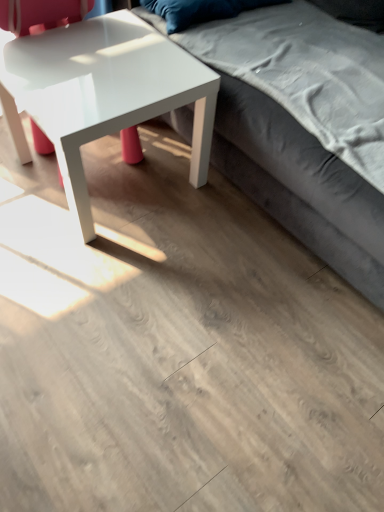
Question: Is velvet blue pillow at upper center next to velvet gray couch at upper right?

Choices:
 (A) yes
 (B) no

Answer: (B)

Question: Is the position of velvet blue pillow at upper center more distant than that of velvet gray couch at upper right?

Choices:
 (A) yes
 (B) no

Answer: (A)

Question: Can you confirm if velvet blue pillow at upper center is smaller than velvet gray couch at upper right?

Choices:
 (A) no
 (B) yes

Answer: (B)

Question: Does velvet blue pillow at upper center have a lesser width compared to velvet gray couch at upper right?

Choices:
 (A) no
 (B) yes

Answer: (B)

Question: Considering the relative sizes of velvet blue pillow at upper center and velvet gray couch at upper right in the image provided, is velvet blue pillow at upper center wider than velvet gray couch at upper right?

Choices:
 (A) yes
 (B) no

Answer: (B)

Question: Considering the relative positions of velvet blue pillow at upper center and velvet gray couch at upper right in the image provided, is velvet blue pillow at upper center to the right of velvet gray couch at upper right from the viewer's perspective?

Choices:
 (A) no
 (B) yes

Answer: (A)

Question: From the image's perspective, does glossy white coffee table at left appear lower than velvet gray couch at upper right?

Choices:
 (A) no
 (B) yes

Answer: (B)

Question: Does glossy white coffee table at left have a lesser height compared to velvet gray couch at upper right?

Choices:
 (A) no
 (B) yes

Answer: (B)

Question: From the image's perspective, does glossy white coffee table at left appear higher than velvet gray couch at upper right?

Choices:
 (A) no
 (B) yes

Answer: (A)

Question: Is glossy white coffee table at left turned away from velvet gray couch at upper right?

Choices:
 (A) no
 (B) yes

Answer: (A)

Question: Is glossy white coffee table at left positioned beyond the bounds of velvet gray couch at upper right?

Choices:
 (A) yes
 (B) no

Answer: (A)

Question: Is glossy white coffee table at left closer to the viewer compared to velvet gray couch at upper right?

Choices:
 (A) yes
 (B) no

Answer: (B)

Question: Considering the relative sizes of velvet gray couch at upper right and glossy white coffee table at left in the image provided, is velvet gray couch at upper right thinner than glossy white coffee table at left?

Choices:
 (A) yes
 (B) no

Answer: (B)